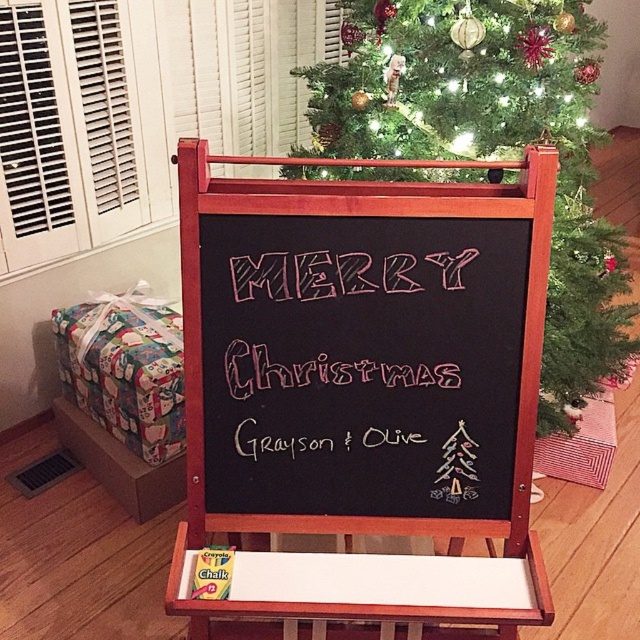
Question: Which is nearer to the pink chalk merry christmas at center?

Choices:
 (A) green textured christmas tree at upper center
 (B) black chalkboard at center

Answer: (B)

Question: Is black chalkboard at center thinner than pink chalk merry christmas at center?

Choices:
 (A) no
 (B) yes

Answer: (A)

Question: Among these objects, which one is farthest from the camera?

Choices:
 (A) green textured christmas tree at upper center
 (B) pink chalk merry christmas at center

Answer: (A)

Question: Which object appears farthest from the camera in this image?

Choices:
 (A) green textured christmas tree at upper center
 (B) pink chalk merry christmas at center
 (C) black chalkboard at center

Answer: (A)

Question: From the image, what is the correct spatial relationship of green textured christmas tree at upper center in relation to pink chalk merry christmas at center?

Choices:
 (A) below
 (B) above

Answer: (B)

Question: Can you confirm if black chalkboard at center is wider than green textured christmas tree at upper center?

Choices:
 (A) yes
 (B) no

Answer: (B)